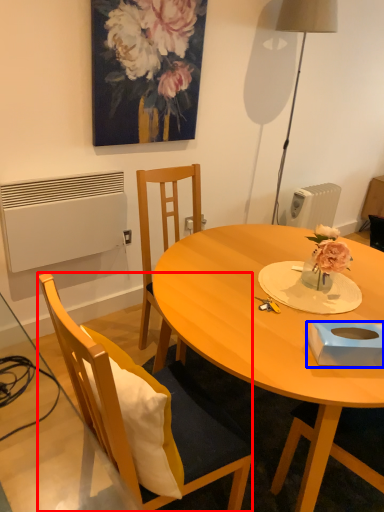
Question: Which object is further to the camera taking this photo, chair (highlighted by a red box) or box (highlighted by a blue box)?

Choices:
 (A) chair
 (B) box

Answer: (B)